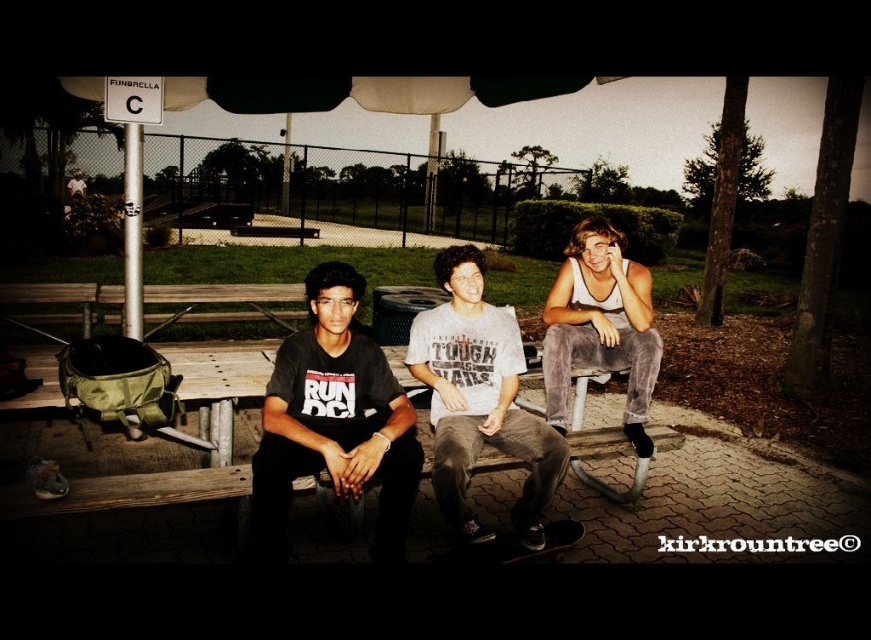
Question: From the image, what is the correct spatial relationship of gray cotton t-shirt at center in relation to gray velvety pants at center?

Choices:
 (A) above
 (B) below

Answer: (B)

Question: Among these objects, which one is farthest from the camera?

Choices:
 (A) gray cotton t-shirt at center
 (B) black matte t-shirt at center

Answer: (A)

Question: Which of the following is the closest to the observer?

Choices:
 (A) gray velvety pants at center
 (B) black matte t-shirt at center

Answer: (B)

Question: Which object appears farthest from the camera in this image?

Choices:
 (A) black matte t-shirt at center
 (B) gray cotton t-shirt at center
 (C) gray velvety pants at center

Answer: (C)

Question: Can you confirm if black matte t-shirt at center is bigger than gray cotton t-shirt at center?

Choices:
 (A) no
 (B) yes

Answer: (A)

Question: Considering the relative positions of black matte t-shirt at center and gray velvety pants at center in the image provided, where is black matte t-shirt at center located with respect to gray velvety pants at center?

Choices:
 (A) above
 (B) below

Answer: (B)